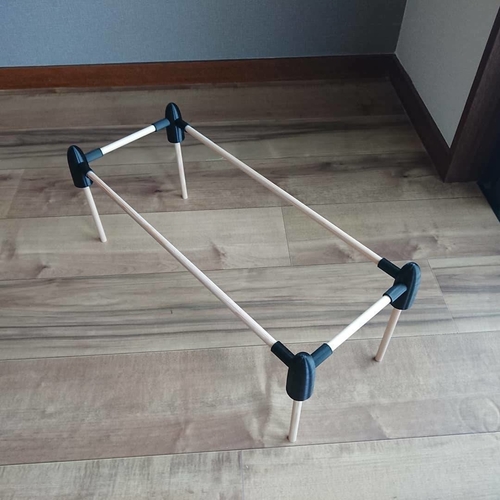
Find the location of a particular element. The height and width of the screenshot is (500, 500). wood molding is located at coordinates (296, 71).